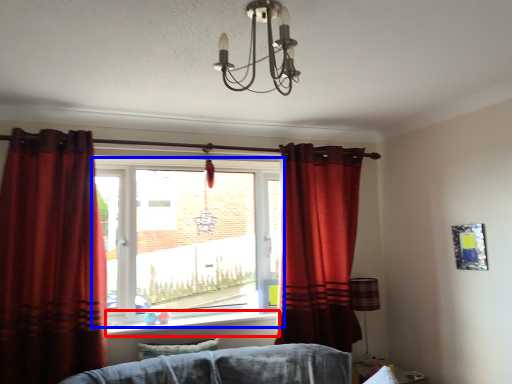
Question: Which object appears farthest to the camera in this image, window sill (highlighted by a red box) or window (highlighted by a blue box)?

Choices:
 (A) window sill
 (B) window

Answer: (B)